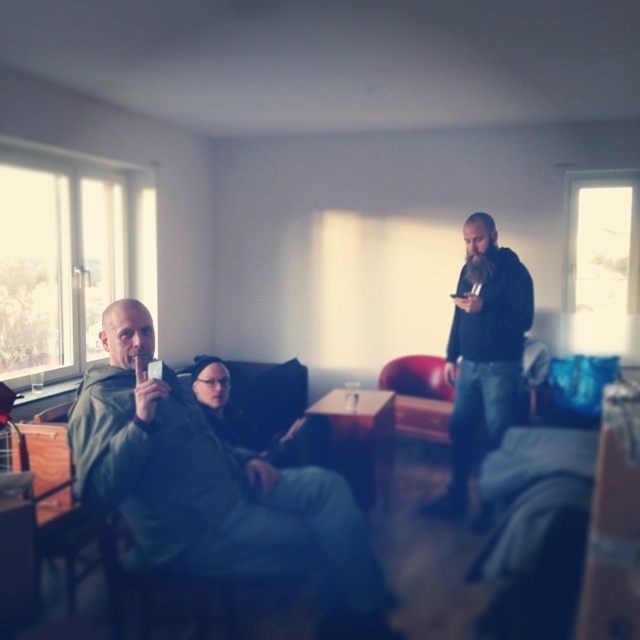
You are a tailor measuring jackets for alterations. You have a 12 inch long hanger rod. Which jacket, the green matte jacket at left or the black matte jacket at right, can you hang on the hanger rod without it touching the ground?

The green matte jacket at left is shorter than the black matte jacket at right, so the green matte jacket at left can be hung on the 12 inch hanger rod without touching the ground since it is shorter.

You are a tailor who needs to determine which jacket requires more fabric for alterations. Based on the image, which of the two jackets, the green matte jacket at left or the black matte jacket at right, would need more fabric due to its size?

The green matte jacket at left requires more fabric for alterations because it has a larger size compared to the black matte jacket at right.